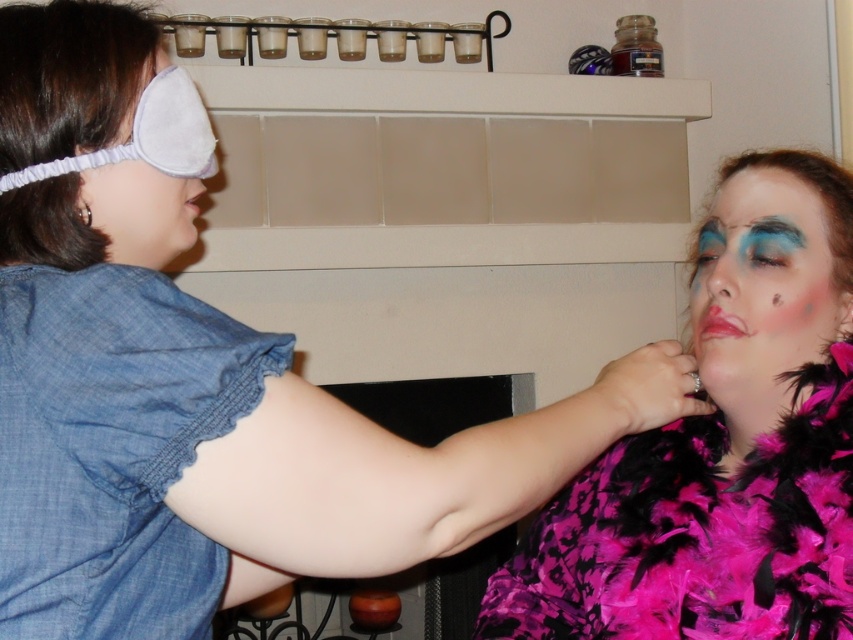
From the picture: Does denim fabric dress at left appear on the left side of gray fabric eye mask at left?

Incorrect, denim fabric dress at left is not on the left side of gray fabric eye mask at left.

Between denim fabric dress at left and gray fabric eye mask at left, which one has less height?

gray fabric eye mask at left

Is point (36, 563) positioned before point (143, 168)?

Yes, it is.

You are a GUI agent. You are given a task and a screenshot of the screen. Output one action in this format:
    pyautogui.click(x=<x>, y=<y>)
    Task: Click on the denim fabric dress at left
    
    Given the screenshot: What is the action you would take?
    pyautogui.click(x=112, y=448)

Is fuzzy pink feather boa at center positioned before matte pink feather boa at right?

That is True.

Between point (845, 177) and point (753, 198), which one is positioned behind?

Point (845, 177)

Where is `fuzzy pink feather boa at center`? fuzzy pink feather boa at center is located at coordinates (722, 445).

Does denim fabric dress at left have a larger size compared to matte pink feather boa at right?

Yes, denim fabric dress at left is bigger than matte pink feather boa at right.

Between point (97, 292) and point (845, 317), which one is positioned in front?

Point (97, 292) is more forward.

Looking at this image, who is more forward, (30, 497) or (720, 324)?

Positioned in front is point (30, 497).

Identify the location of denim fabric dress at left. Image resolution: width=853 pixels, height=640 pixels. (112, 448).